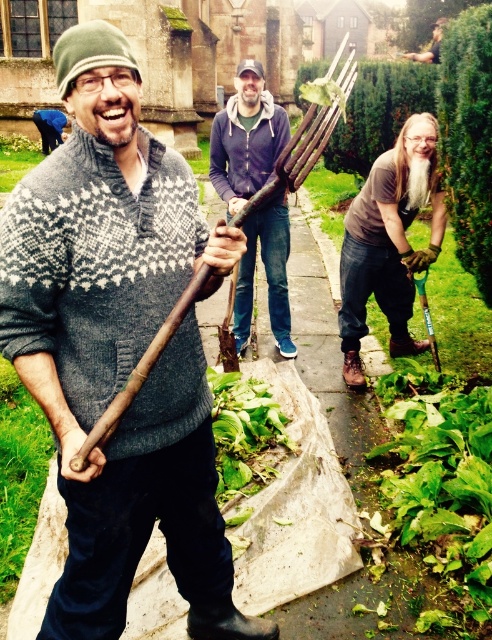
You are a gardener who needs to water the green leafy vegetable at lower right and the green leafy hedge at upper right. Your watering can has a range of 5 feet. Can you water both plants without moving the watering can?

The distance between the green leafy vegetable at lower right and green leafy hedge at upper right is 5.75 feet, which is beyond the 5 feet range of the watering can. Therefore, you cannot water both plants without moving the watering can.